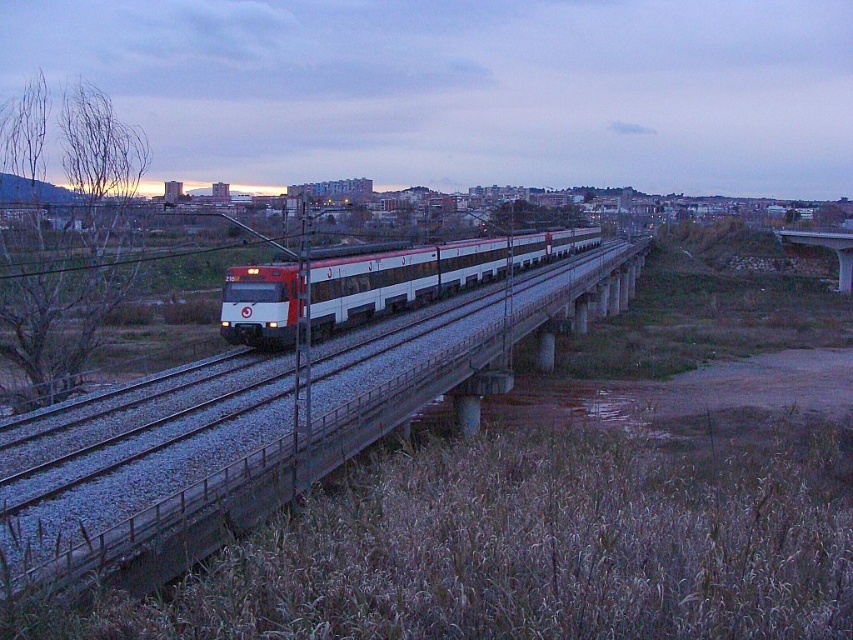
You are standing at the center of the bridge and want to board the white glossy passenger train at center. Since the train is moving from left to right, which direction should you run to catch it before it passes the bridge?

The white glossy passenger train at center is located at point (422, 273), so you should run to the right to catch it before it passes the bridge since it is moving from left to right.

You are a photographer planning to capture the entire white glossy passenger train at center and the concrete bridge at right in a single shot. Given that your camera can only capture objects up to 100 meters in length, will both objects fit within the frame?

The white glossy passenger train at center is shorter than the concrete bridge at right. Since the train is shorter than the bridge, but the total combined length of both might exceed 100 meters. However, the question specifies capturing both in a single shot, which requires each object to be within the camera frame individually. Without exact measurements, it is uncertain if both will fit. However, since the train is shorter than the bridge, if the bridge is under 100 meters, the train would also fit. But